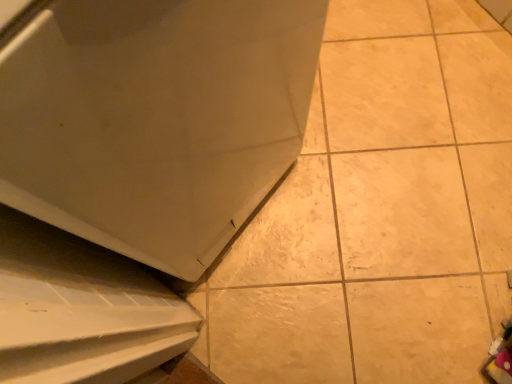
What do you see at coordinates (155, 119) in the screenshot? I see `white matte refrigerator at lower left` at bounding box center [155, 119].

Where is `white matte refrigerator at lower left`? Image resolution: width=512 pixels, height=384 pixels. white matte refrigerator at lower left is located at coordinates (155, 119).

I want to click on white matte refrigerator at lower left, so click(155, 119).